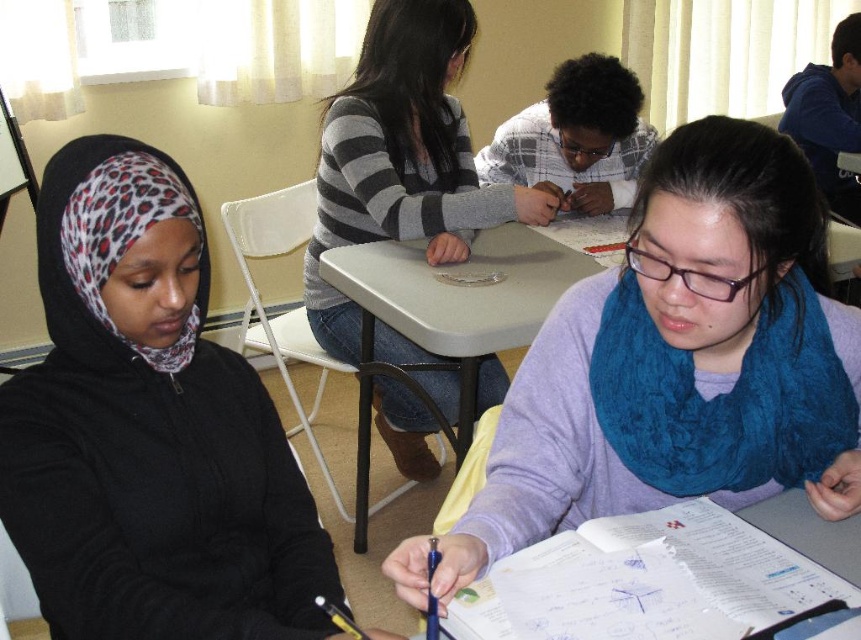
You are a student sitting at the table in the classroom. You notice the purple soft scarf at center and the plaid fabric shirt at center. Which one is closer to the bottom of the image?

The purple soft scarf at center is located below the plaid fabric shirt at center, so it is closer to the bottom of the image.

You are standing at the front of the classroom and looking towards the students. Which of the two points, point (431, 200) or point (580, 172), is closer to you?

Point (431, 200) is closer to you because it is in front of point (580, 172).

You are standing in the classroom and want to move from point A to point B. Point A is at coordinate point (852, 490) and point B is at coordinate point (426, 214). Which point is closer to you when you first enter the classroom?

Point A at coordinate point (852, 490) is closer to the viewer than point B at coordinate point (426, 214).